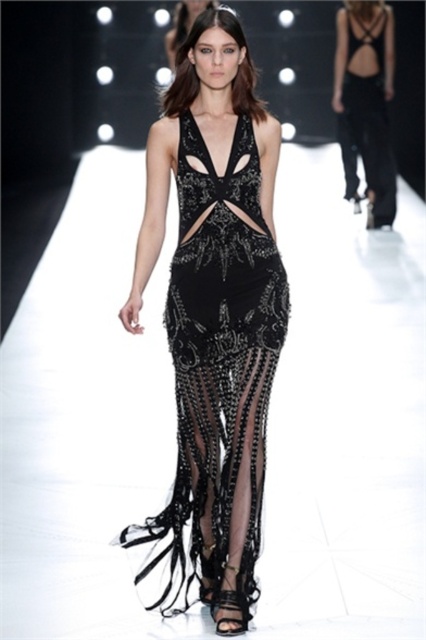
Question: Which point is farther from the camera taking this photo?

Choices:
 (A) (334, 81)
 (B) (178, 20)
 (C) (184, 552)
 (D) (218, 589)

Answer: (B)

Question: Which of the following is the closest to the observer?

Choices:
 (A) (255, 147)
 (B) (239, 624)

Answer: (B)

Question: Which of these objects is positioned closest to the black leather sandal at center?

Choices:
 (A) satin black dress at center
 (B) black sequined dress at center

Answer: (B)

Question: Can you confirm if black sheer dress at center is positioned to the right of black leather sandal at center?

Choices:
 (A) yes
 (B) no

Answer: (A)

Question: Can you confirm if black sequined dress at center is wider than black leather sandal at center?

Choices:
 (A) no
 (B) yes

Answer: (B)

Question: Can you confirm if black sheer dress at center is bigger than black leather sandal at center?

Choices:
 (A) yes
 (B) no

Answer: (A)